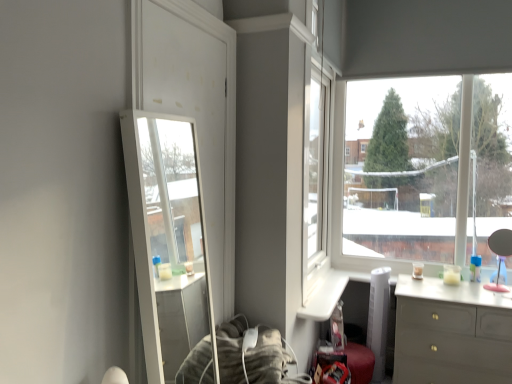
Question: Considering their positions, is transparent glass window at upper right located in front of or behind clear glass mirror at left?

Choices:
 (A) behind
 (B) front

Answer: (A)

Question: Considering the positions of transparent glass window at upper right and clear glass mirror at left in the image, is transparent glass window at upper right taller or shorter than clear glass mirror at left?

Choices:
 (A) short
 (B) tall

Answer: (A)

Question: Which is nearer to the matte gray dresser at lower right?

Choices:
 (A) clear glass mirror at left
 (B) transparent glass window at upper right

Answer: (B)

Question: Considering the real-world distances, which object is closest to the matte gray dresser at lower right?

Choices:
 (A) clear glass mirror at left
 (B) transparent glass window at upper right

Answer: (B)